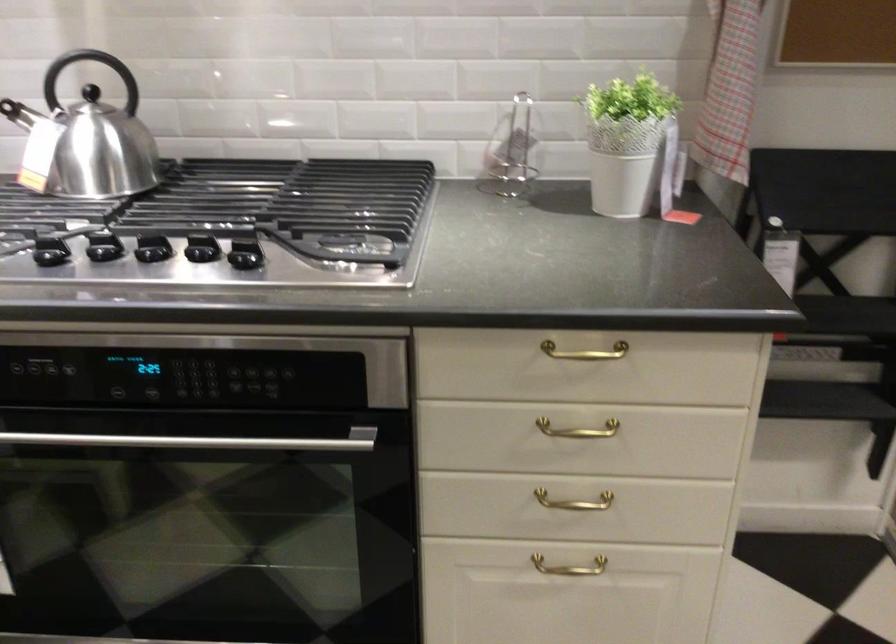
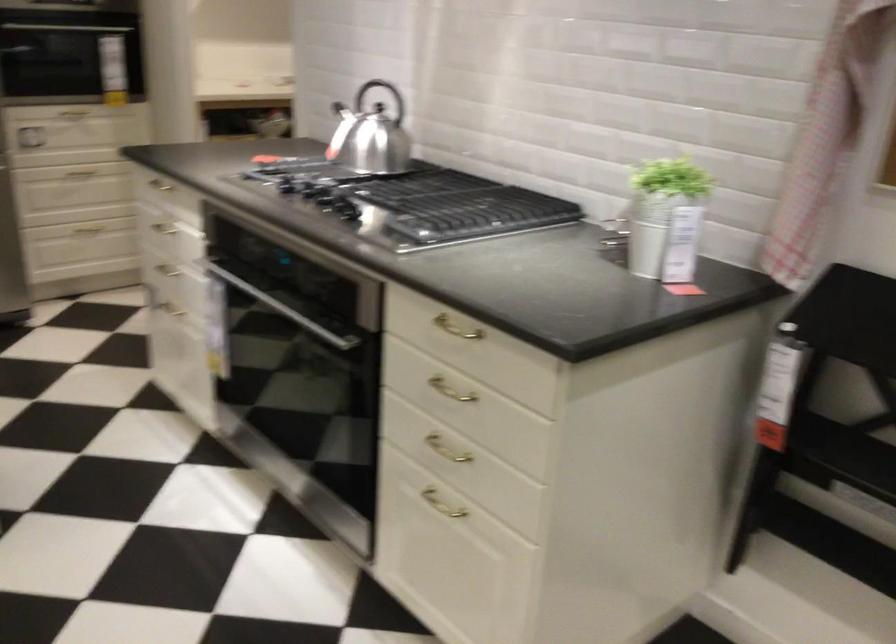
Where in the second image is the point corresponding to (653,147) from the first image?

(666, 219)